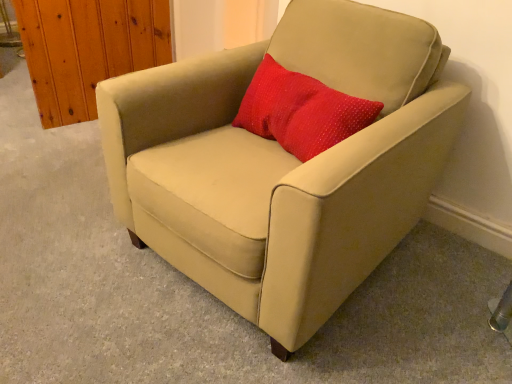
Identify the location of beige fabric armchair at center. Image resolution: width=512 pixels, height=384 pixels. (283, 164).

In order to face beige fabric armchair at center, should I rotate leftwards or rightwards?

It's best to rotate right around 4.009 degrees.

The height and width of the screenshot is (384, 512). Describe the element at coordinates (283, 164) in the screenshot. I see `beige fabric armchair at center` at that location.

Based on the photo, measure the distance between beige fabric armchair at center and camera.

beige fabric armchair at center is 81.81 centimeters from camera.

The width and height of the screenshot is (512, 384). Describe the element at coordinates (300, 111) in the screenshot. I see `red dotted fabric pillow at center` at that location.

Where is `red dotted fabric pillow at center`? red dotted fabric pillow at center is located at coordinates (300, 111).

Locate an element on the screen. beige fabric armchair at center is located at coordinates (283, 164).

Which object is positioned more to the left, red dotted fabric pillow at center or beige fabric armchair at center?

Positioned to the left is beige fabric armchair at center.

Is the position of red dotted fabric pillow at center less distant than that of beige fabric armchair at center?

That is False.

Is point (320, 148) closer to camera compared to point (379, 238)?

That is False.

From the picture: From the image's perspective, relative to beige fabric armchair at center, is red dotted fabric pillow at center above or below?

red dotted fabric pillow at center is above beige fabric armchair at center.

From a real-world perspective, is red dotted fabric pillow at center over beige fabric armchair at center?

Yes.

Considering the sizes of objects red dotted fabric pillow at center and beige fabric armchair at center in the image provided, who is wider, red dotted fabric pillow at center or beige fabric armchair at center?

With larger width is beige fabric armchair at center.

Is red dotted fabric pillow at center taller than beige fabric armchair at center?

No.

Looking at this image, considering the sizes of objects red dotted fabric pillow at center and beige fabric armchair at center in the image provided, who is smaller, red dotted fabric pillow at center or beige fabric armchair at center?

With smaller size is red dotted fabric pillow at center.

Is red dotted fabric pillow at center spatially inside beige fabric armchair at center, or outside of it?

red dotted fabric pillow at center can be found inside beige fabric armchair at center.

Would you say red dotted fabric pillow at center is a long distance from beige fabric armchair at center?

No.

Is red dotted fabric pillow at center aimed at beige fabric armchair at center?

Yes.

How many degrees apart are the facing directions of red dotted fabric pillow at center and beige fabric armchair at center?

The facing directions of red dotted fabric pillow at center and beige fabric armchair at center are 2.33 degrees apart.

Measure the distance between red dotted fabric pillow at center and beige fabric armchair at center.

red dotted fabric pillow at center is 8.54 inches away from beige fabric armchair at center.

This screenshot has height=384, width=512. In the image, there is a red dotted fabric pillow at center. Identify the location of chair below it (from the image's perspective). (283, 164).

Considering the relative positions of beige fabric armchair at center and red dotted fabric pillow at center in the image provided, is beige fabric armchair at center to the left of red dotted fabric pillow at center from the viewer's perspective?

Yes.

Looking at this image, is beige fabric armchair at center closer to camera compared to red dotted fabric pillow at center?

That is True.

Considering the points (149, 144) and (283, 102), which point is in front, point (149, 144) or point (283, 102)?

The point (283, 102) is closer to the camera.

From the image's perspective, between beige fabric armchair at center and red dotted fabric pillow at center, who is located below?

beige fabric armchair at center is shown below in the image.

From a real-world perspective, relative to red dotted fabric pillow at center, is beige fabric armchair at center vertically above or below?

Clearly, from a real-world perspective, beige fabric armchair at center is below red dotted fabric pillow at center.

Is beige fabric armchair at center wider or thinner than red dotted fabric pillow at center?

In the image, beige fabric armchair at center appears to be wider than red dotted fabric pillow at center.

In terms of height, does beige fabric armchair at center look taller or shorter compared to red dotted fabric pillow at center?

Clearly, beige fabric armchair at center is taller compared to red dotted fabric pillow at center.

Between beige fabric armchair at center and red dotted fabric pillow at center, which one has larger size?

With larger size is beige fabric armchair at center.

Is red dotted fabric pillow at center inside beige fabric armchair at center?

Yes, beige fabric armchair at center is surrounding red dotted fabric pillow at center.

Is the surface of beige fabric armchair at center in direct contact with red dotted fabric pillow at center?

They are not placed beside each other.

Based on the photo, is beige fabric armchair at center turned away from red dotted fabric pillow at center?

Yes, beige fabric armchair at center is positioned with its back facing red dotted fabric pillow at center.

How many degrees apart are the facing directions of beige fabric armchair at center and red dotted fabric pillow at center?

The angular difference between beige fabric armchair at center and red dotted fabric pillow at center is 2.33 degrees.

Locate an element on the screen. The width and height of the screenshot is (512, 384). throw pillow located above the beige fabric armchair at center (from the image's perspective) is located at coordinates (300, 111).

The image size is (512, 384). I want to click on chair on the left of red dotted fabric pillow at center, so click(283, 164).

Locate an element on the screen. Image resolution: width=512 pixels, height=384 pixels. chair in front of the red dotted fabric pillow at center is located at coordinates (283, 164).